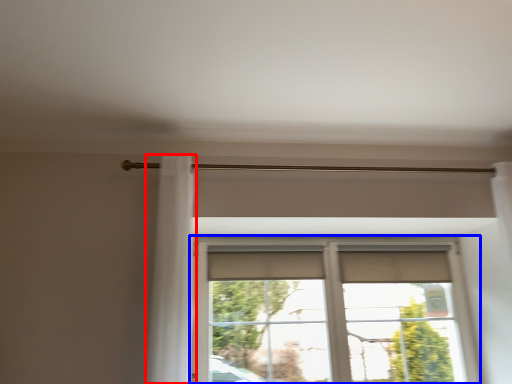
Question: Among these objects, which one is nearest to the camera, shower curtain (highlighted by a red box) or window (highlighted by a blue box)?

Choices:
 (A) shower curtain
 (B) window

Answer: (A)